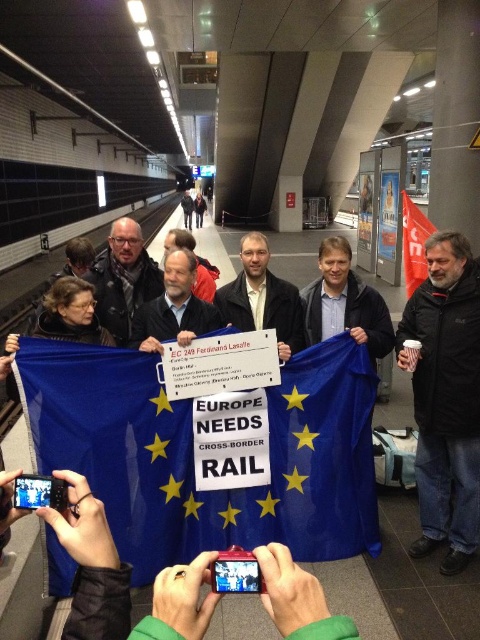
Does black jacket at right have a lesser width compared to red fabric flag at right?

No.

Find the location of a particular element. The height and width of the screenshot is (640, 480). black jacket at right is located at coordinates (445, 397).

Which is behind, point (230, 323) or point (213, 305)?

The point (213, 305) is more distant.

Locate an element on the screen. The width and height of the screenshot is (480, 640). matte black sign at center is located at coordinates (x=263, y=298).

Find the location of a particular element. The height and width of the screenshot is (640, 480). matte black sign at center is located at coordinates (263, 298).

I want to click on dark gray jacket at center, so click(x=123, y=278).

Does point (129, 291) come farther from viewer compared to point (190, 269)?

Yes.

Locate an element on the screen. Image resolution: width=480 pixels, height=640 pixels. dark gray jacket at center is located at coordinates (123, 278).